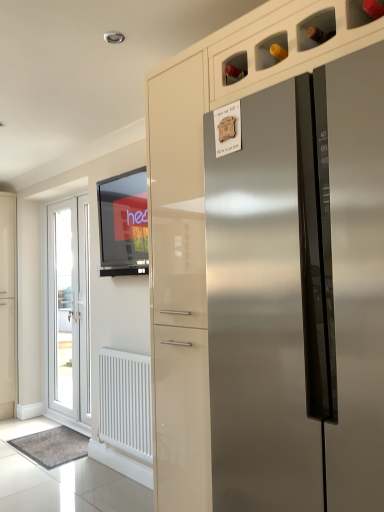
You are a GUI agent. You are given a task and a screenshot of the screen. Output one action in this format:
    pyautogui.click(x=<x>, y=<y>)
    Task: Click on the empty space that is ontop of white matte radiator at lower left
    
    Given the screenshot: What is the action you would take?
    pyautogui.click(x=127, y=348)